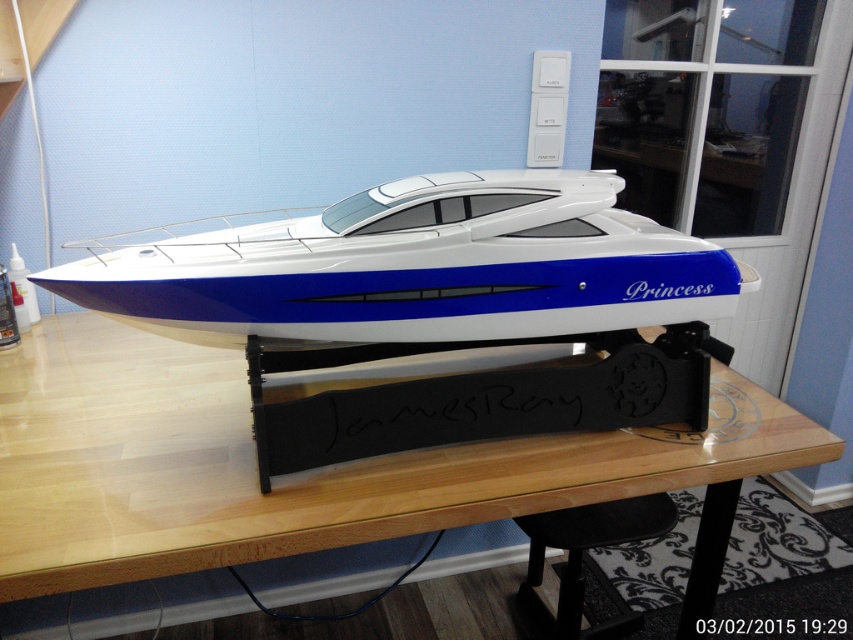
Question: Is wooden table at center positioned behind black matte stool at lower center?

Choices:
 (A) yes
 (B) no

Answer: (B)

Question: Can you confirm if blue glossy boat at center is wider than wooden table at center?

Choices:
 (A) yes
 (B) no

Answer: (B)

Question: Which is farther from the wooden table at center?

Choices:
 (A) blue glossy boat at center
 (B) black matte stool at lower center

Answer: (B)

Question: Is blue glossy boat at center to the right of wooden table at center from the viewer's perspective?

Choices:
 (A) yes
 (B) no

Answer: (A)

Question: Which point appears closest to the camera in this image?

Choices:
 (A) (703, 298)
 (B) (439, 525)

Answer: (B)

Question: Among these objects, which one is farthest from the camera?

Choices:
 (A) black matte stool at lower center
 (B) wooden table at center

Answer: (A)